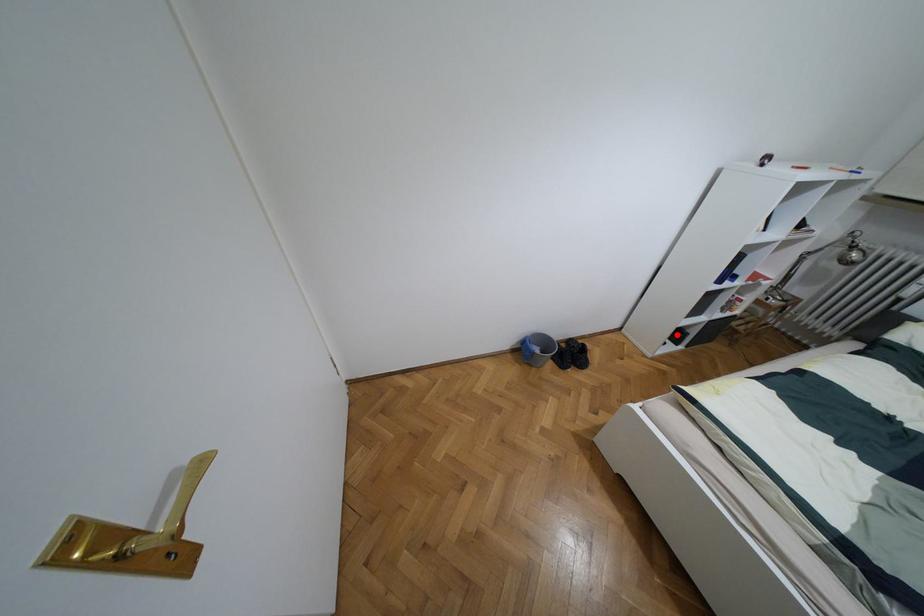
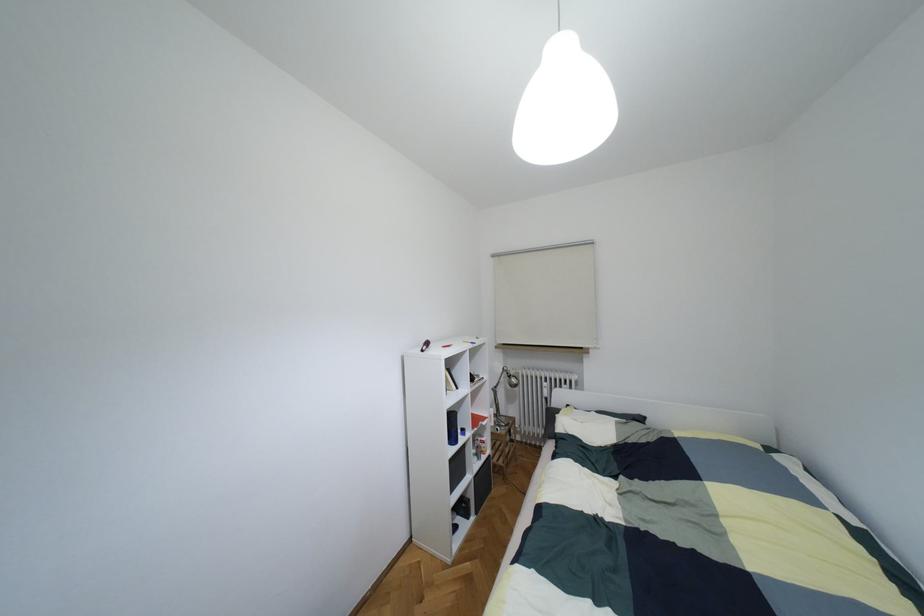
Question: I am providing you with two images of the same scene from different viewpoints. Image1 has a red point marked. In image2, the corresponding 3D location appears at what relative position? Reply with the corresponding letter.

Choices:
 (A) Closer
 (B) Farther

Answer: (B)